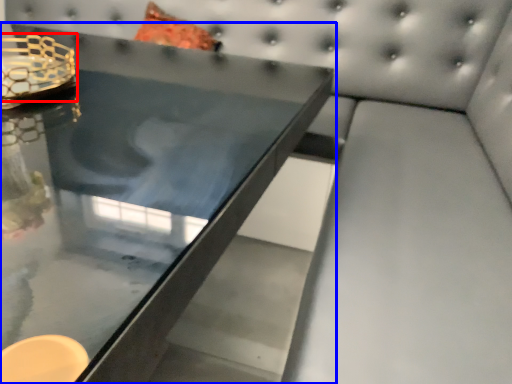
Question: Which object is closer to the camera taking this photo, candle holder (highlighted by a red box) or table (highlighted by a blue box)?

Choices:
 (A) candle holder
 (B) table

Answer: (B)